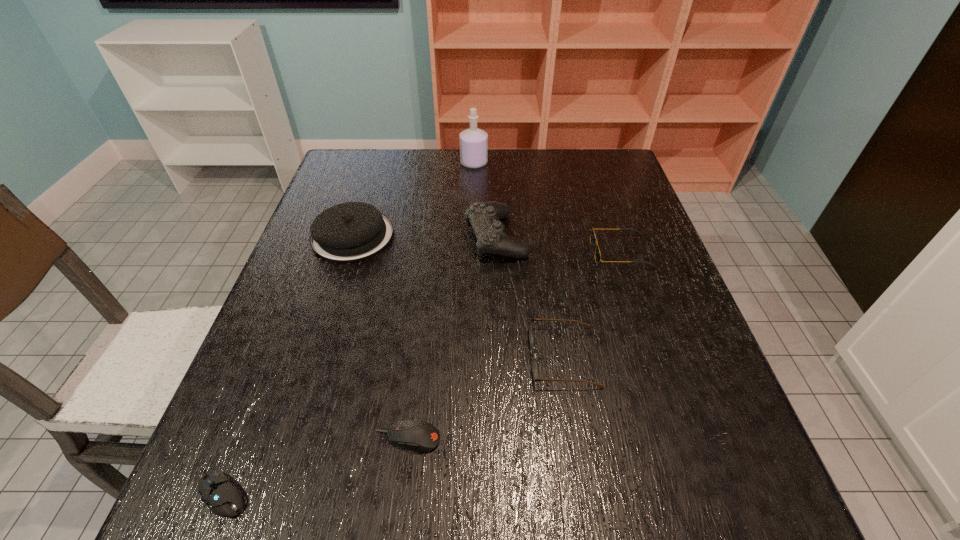
Where is `vacant space at the left edge of the desktop`? The image size is (960, 540). vacant space at the left edge of the desktop is located at coordinates (252, 441).

The height and width of the screenshot is (540, 960). What are the coordinates of `vacant space at the right edge of the desktop` in the screenshot? It's located at (623, 299).

Where is `vacant region at the far left corner of the desktop`? The image size is (960, 540). vacant region at the far left corner of the desktop is located at coordinates [x=376, y=180].

At what (x,y) coordinates should I click in order to perform the action: click on vacant space that's between the sunglasses and the control. Please return your answer as a coordinate pair (x, y). The height and width of the screenshot is (540, 960). Looking at the image, I should click on tap(559, 244).

In order to click on free space that is in between the control and the fifth farthest object in this screenshot , I will do `click(530, 296)`.

Image resolution: width=960 pixels, height=540 pixels. Identify the location of free space between the left computer mouse and the sunglasses. (420, 373).

This screenshot has width=960, height=540. In order to click on empty location between the perfume and the left computer mouse in this screenshot , I will do `click(348, 328)`.

At what (x,y) coordinates should I click in order to perform the action: click on empty location between the right computer mouse and the perfume. Please return your answer as a coordinate pair (x, y). The width and height of the screenshot is (960, 540). Looking at the image, I should click on (441, 300).

Where is `vacant space that's between the pancake and the third nearest object`? vacant space that's between the pancake and the third nearest object is located at coordinates (458, 296).

Image resolution: width=960 pixels, height=540 pixels. Find the location of `unoccupied area between the fourth shortest object and the sixth shortest object`. unoccupied area between the fourth shortest object and the sixth shortest object is located at coordinates (559, 244).